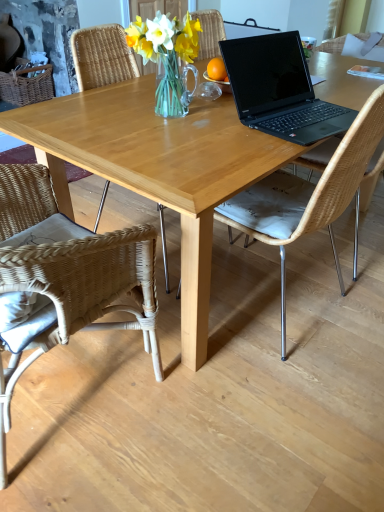
Question: Is point (294, 198) closer or farther from the camera than point (127, 229)?

Choices:
 (A) closer
 (B) farther

Answer: (B)

Question: Is natural wicker chair at center, which is the 1th chair in right-to-left order, inside or outside of woven rattan chair at lower left, acting as the first chair starting from the left?

Choices:
 (A) outside
 (B) inside

Answer: (A)

Question: Based on their relative distances, which object is farther from the clear glass vase at center?

Choices:
 (A) black matte laptop at center
 (B) woven rattan chair at lower left, positioned as the second chair in right-to-left order
 (C) light wood table at center
 (D) natural wicker chair at center, the second chair viewed from the left

Answer: (B)

Question: Which object is positioned closest to the natural wicker chair at center, the second chair viewed from the left?

Choices:
 (A) black matte laptop at center
 (B) light wood table at center
 (C) woven rattan chair at lower left, positioned as the second chair in right-to-left order
 (D) clear glass vase at center

Answer: (A)